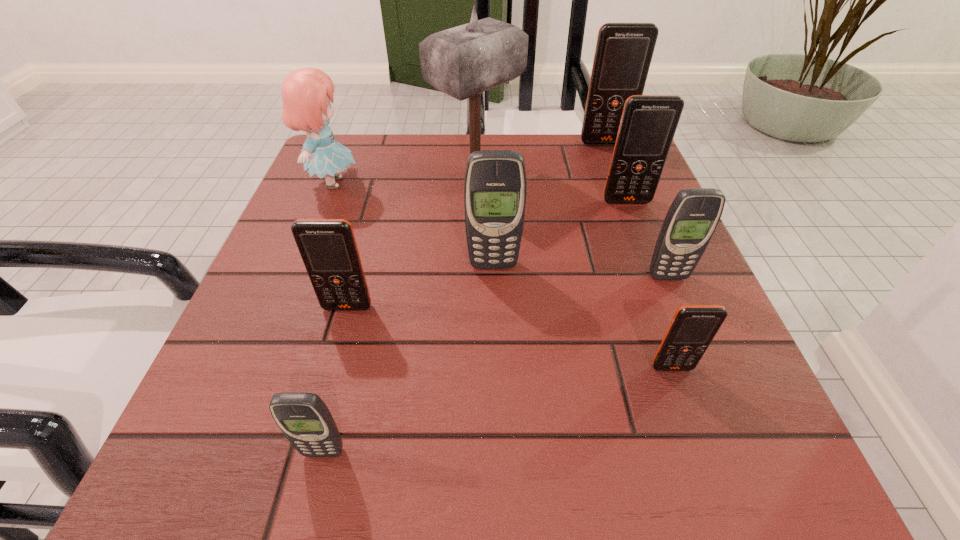
At what (x,y) coordinates should I click in order to perform the action: click on the tallest object. Please return your answer as a coordinate pair (x, y). Looking at the image, I should click on (464, 61).

This screenshot has width=960, height=540. I want to click on the farthest cellular telephone, so click(x=623, y=54).

Locate an element on the screen. This screenshot has width=960, height=540. the farthest object is located at coordinates 623,54.

Identify the location of doll. The image size is (960, 540). (306, 93).

This screenshot has width=960, height=540. Identify the location of blue doll. (306, 93).

I want to click on the second biggest orange cellular telephone, so click(648, 124).

The width and height of the screenshot is (960, 540). I want to click on the third nearest orange cellular telephone, so click(x=648, y=124).

Identify the location of the third cellular telephone from left to right. Image resolution: width=960 pixels, height=540 pixels. (495, 188).

The image size is (960, 540). Identify the location of the third farthest cellular telephone. (495, 188).

The width and height of the screenshot is (960, 540). Identify the location of the fourth farthest cellular telephone. (694, 214).